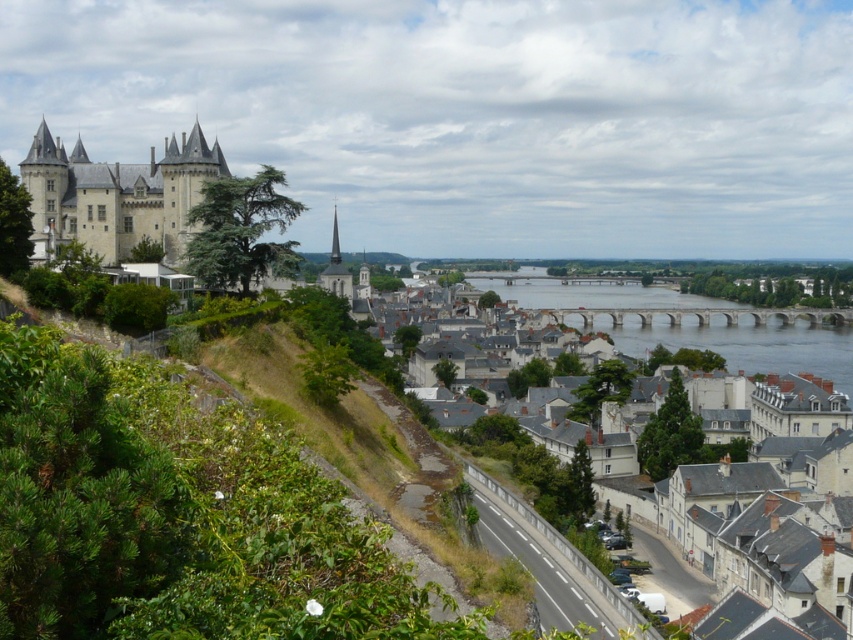
Question: Estimate the real-world distances between objects in this image. Which object is farther from the brown stone bridge at center?

Choices:
 (A) smooth stone castle at upper left
 (B) gray stone buildings at center

Answer: (A)

Question: Considering the relative positions of smooth stone castle at upper left and brown stone bridge at center in the image provided, where is smooth stone castle at upper left located with respect to brown stone bridge at center?

Choices:
 (A) above
 (B) below

Answer: (A)

Question: Among these points, which one is farthest from the camera?

Choices:
 (A) (469, 305)
 (B) (67, 182)
 (C) (740, 307)

Answer: (C)

Question: Estimate the real-world distances between objects in this image. Which object is closer to the brown stone bridge at center?

Choices:
 (A) smooth stone castle at upper left
 (B) gray stone buildings at center

Answer: (B)

Question: Is gray stone buildings at center above brown stone bridge at center?

Choices:
 (A) no
 (B) yes

Answer: (B)

Question: Does gray stone buildings at center have a smaller size compared to brown stone bridge at center?

Choices:
 (A) no
 (B) yes

Answer: (A)